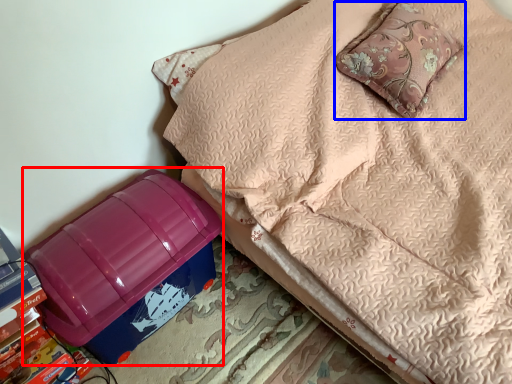
Question: Which point is further to the camera, storage box (highlighted by a red box) or pillow (highlighted by a blue box)?

Choices:
 (A) storage box
 (B) pillow

Answer: (B)